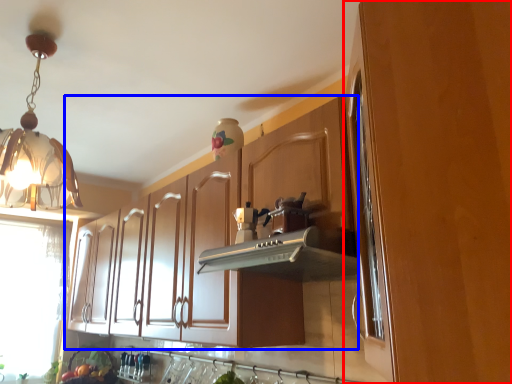
Question: Which point is further to the camera, cabinetry (highlighted by a red box) or cabinetry (highlighted by a blue box)?

Choices:
 (A) cabinetry
 (B) cabinetry

Answer: (B)